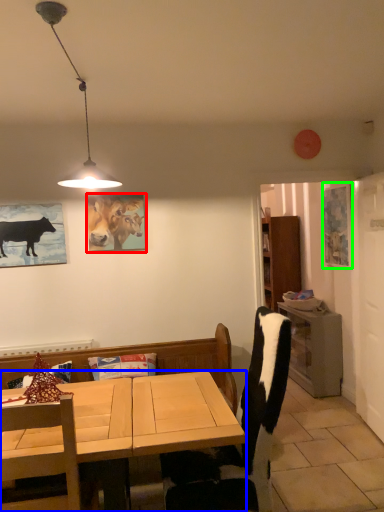
Question: Which object is the closest to the picture frame (highlighted by a red box)? Choose among these: desk (highlighted by a blue box) or picture frame (highlighted by a green box).

Choices:
 (A) desk
 (B) picture frame

Answer: (A)